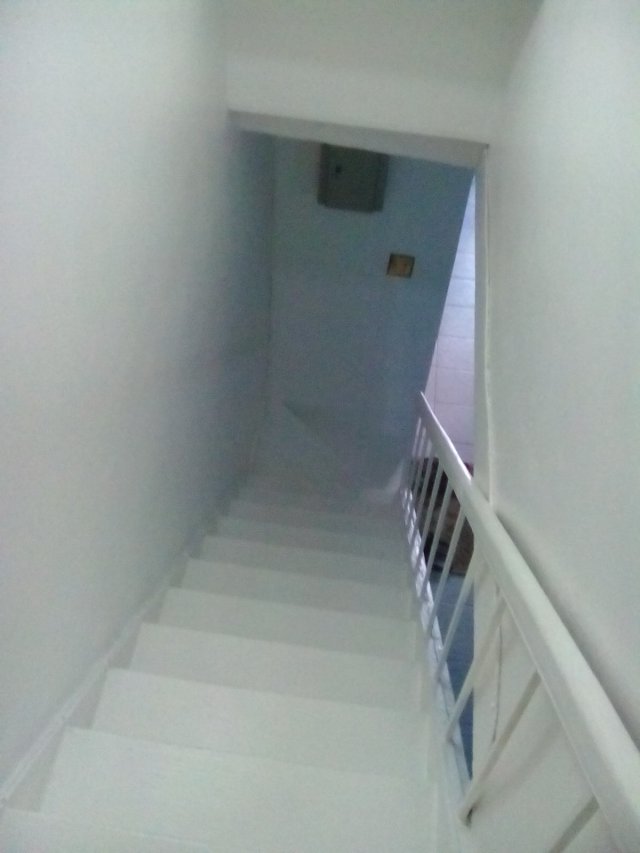
You are a GUI agent. You are given a task and a screenshot of the screen. Output one action in this format:
    pyautogui.click(x=<x>, y=<y>)
    Task: Click on the door mat
    
    Given the screenshot: What is the action you would take?
    pyautogui.click(x=450, y=511)